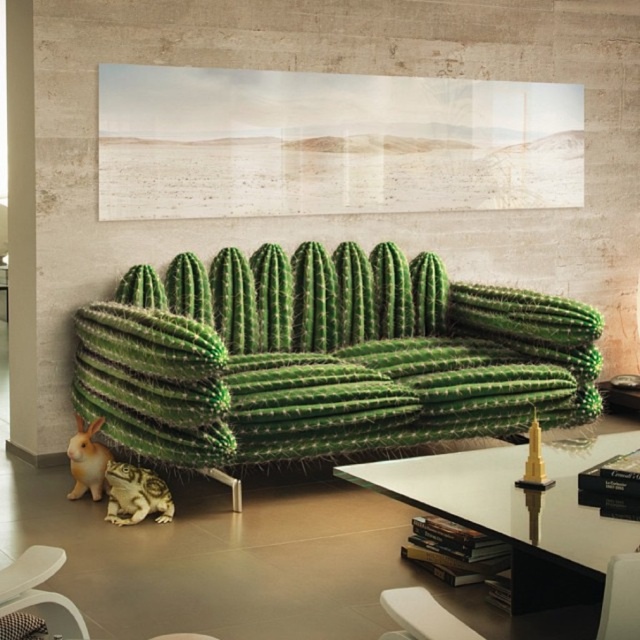
Question: Which of these objects is positioned closest to the transparent glass table at center?

Choices:
 (A) green textured cactus at lower left
 (B) fluffy white rabbit at lower left
 (C) green spiky cactus at center
 (D) matte black armchair at lower right

Answer: (D)

Question: Does transparent glass table at center come in front of matte black armchair at lower right?

Choices:
 (A) yes
 (B) no

Answer: (B)

Question: Which point is farther to the camera?

Choices:
 (A) (106, 483)
 (B) (81, 474)
 (C) (508, 365)

Answer: (C)

Question: Is transparent glass table at center thinner than green textured cactus at lower left?

Choices:
 (A) yes
 (B) no

Answer: (B)

Question: Among these objects, which one is nearest to the camera?

Choices:
 (A) matte black armchair at lower right
 (B) fluffy white rabbit at lower left

Answer: (A)

Question: Is green spiky cactus at center smaller than matte black armchair at lower right?

Choices:
 (A) yes
 (B) no

Answer: (B)